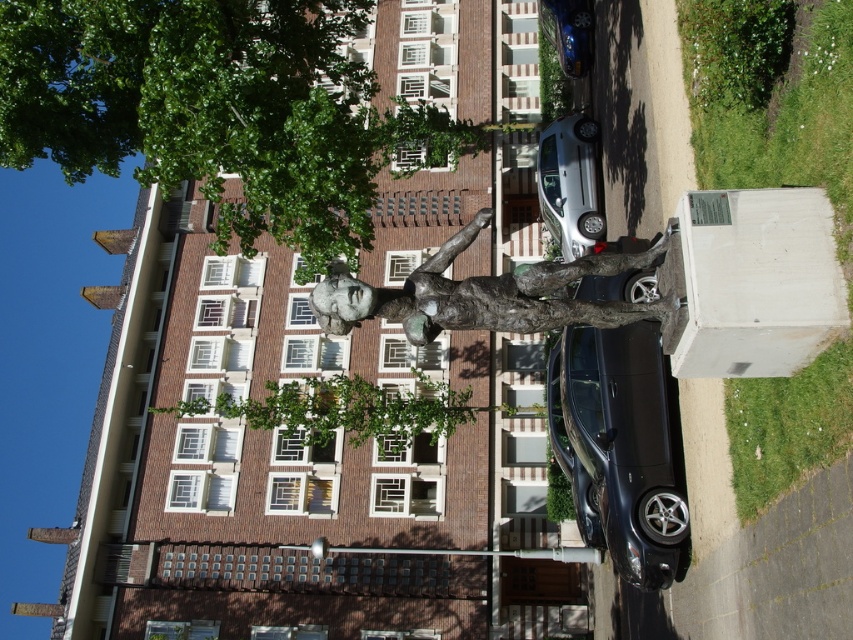
You are a city planner assessing the urban space in front of the building. You notice the green leafy tree at center and the silver metallic car at center. Which object occupies more space in the scene?

The green leafy tree at center is larger in size than the silver metallic car at center, so it occupies more space in the scene.

You are standing in front of the building and want to take a photo that includes both the statue and the building. The statue is at point (305, 390) and the building is at point (556, 177). Since you want the statue to appear larger in the photo, which point should you focus on first?

Point (305, 390) is further to the camera than point (556, 177), so focusing on the statue at point (305, 390) first will make it appear larger in the photo.

You are a city planner assessing the urban space in front of the multi story brick building. You need to determine if the bronze statue at center and the green leafy tree at center can be placed closer together without obstructing each other. Based on their sizes, what do you recommend?

The bronze statue at center is larger in size than the green leafy tree at center. Since the statue is bigger, placing them closer might cause the tree to be overshadowed or blocked by the statue. It is recommended to keep some distance between them to ensure both elements are visible and functional in the urban space.